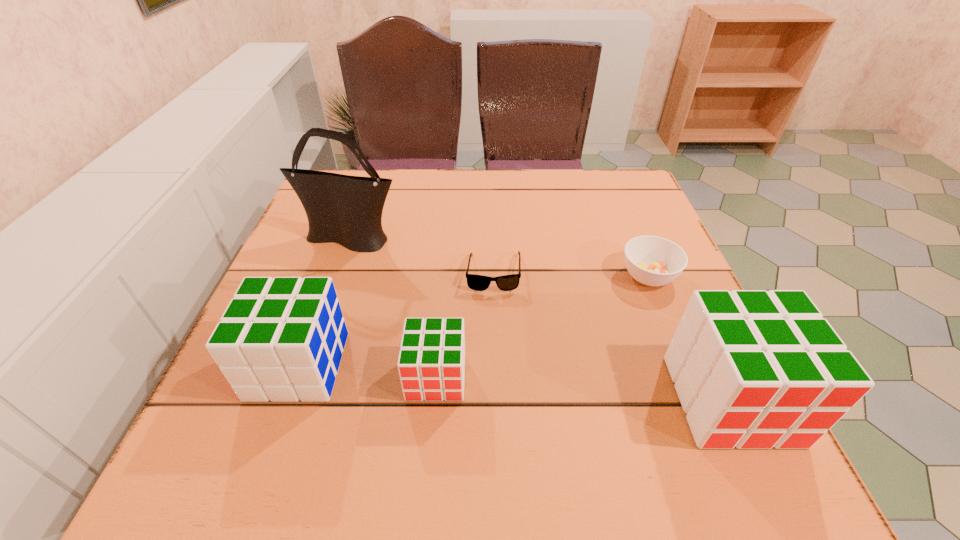
To make them evenly spaced by inserting another cube among them, please locate a vacant spot for this new cube. Please provide its 2D coordinates. Your answer should be formatted as a tuple, i.e. [(x, y)], where the tuple contains the x and y coordinates of a point satisfying the conditions above.

[(580, 388)]